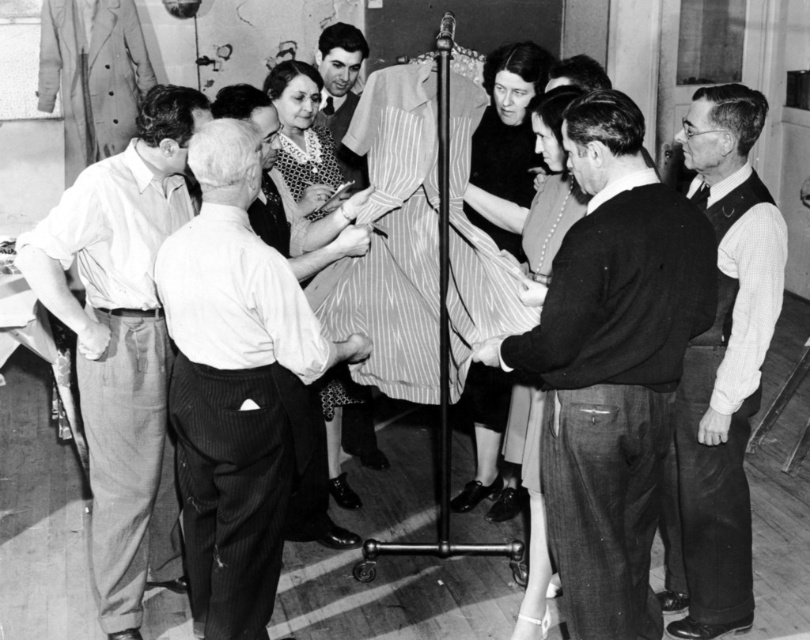
Can you confirm if white pinstripe suit at center is shorter than patterned fabric dress at center?

No.

Who is taller, white pinstripe suit at center or patterned fabric dress at center?

white pinstripe suit at center is taller.

Describe the element at coordinates (235, 385) in the screenshot. I see `white pinstripe suit at center` at that location.

At what (x,y) coordinates should I click in order to perform the action: click on white pinstripe suit at center. Please return your answer as a coordinate pair (x, y). The image size is (810, 640). Looking at the image, I should click on (235, 385).

Is point (621, 129) farther from camera compared to point (308, 216)?

No.

Can you confirm if dark gray sweater at center is wider than patterned fabric dress at center?

Yes.

Locate an element on the screen. The image size is (810, 640). dark gray sweater at center is located at coordinates (612, 364).

The width and height of the screenshot is (810, 640). Identify the location of dark gray sweater at center. (612, 364).

Between polka dot blouse at center and smooth black shirt at center, which one has less height?

With less height is polka dot blouse at center.

Identify the location of polka dot blouse at center. Image resolution: width=810 pixels, height=640 pixels. (301, 136).

This screenshot has width=810, height=640. What are the coordinates of `polka dot blouse at center` in the screenshot? It's located at (301, 136).